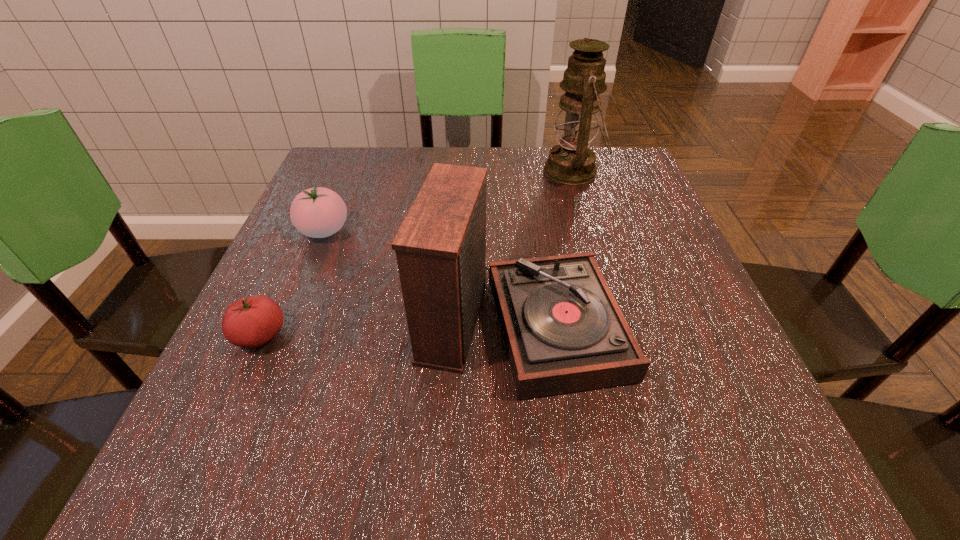
At what (x,y) coordinates should I click in order to perform the action: click on the farthest object. Please return your answer as a coordinate pair (x, y). Image resolution: width=960 pixels, height=540 pixels. Looking at the image, I should click on (572, 162).

At what (x,y) coordinates should I click in order to perform the action: click on oil lamp. Please return your answer as a coordinate pair (x, y). This screenshot has width=960, height=540. Looking at the image, I should click on (572, 162).

This screenshot has width=960, height=540. In order to click on the third shortest object in this screenshot , I will do `click(564, 332)`.

Where is `the second farthest object`? The height and width of the screenshot is (540, 960). the second farthest object is located at coordinates (318, 212).

Where is `the third tallest object`? the third tallest object is located at coordinates (318, 212).

Where is `the shorter tomato`? the shorter tomato is located at coordinates (250, 322).

Where is `the shortest object`? This screenshot has height=540, width=960. the shortest object is located at coordinates (250, 322).

The width and height of the screenshot is (960, 540). Identify the location of free space located 0.090m on the left of the oil lamp. (506, 171).

This screenshot has height=540, width=960. Identify the location of free space located on the back of the phonograph record. (513, 230).

This screenshot has width=960, height=540. I want to click on vacant area located on the right of the second shortest object, so click(x=469, y=231).